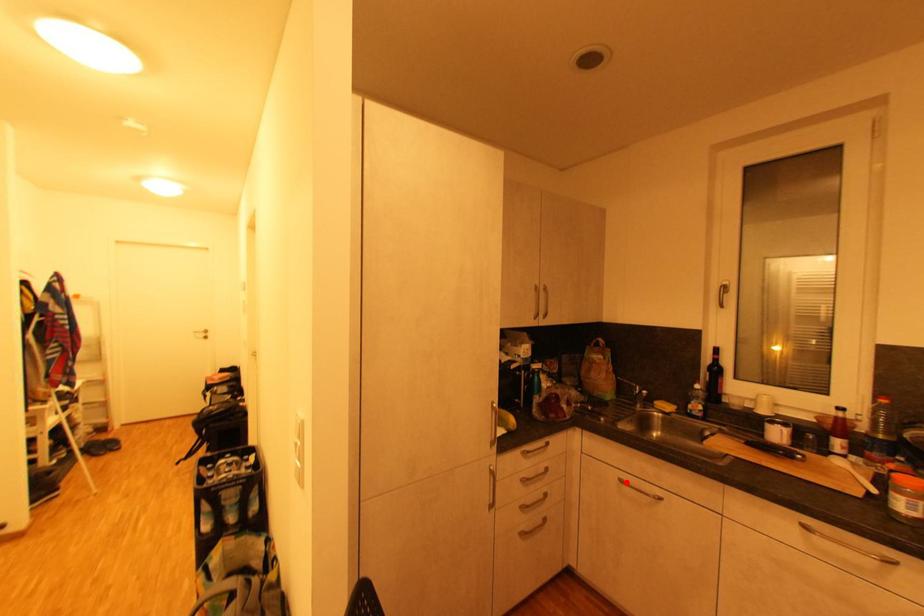
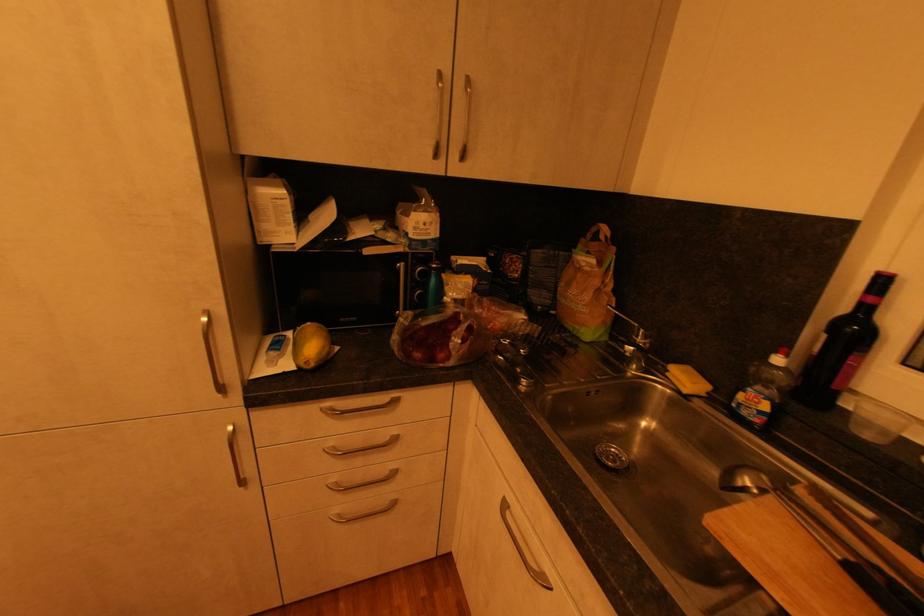
Question: I am providing you with two images of the same scene from different viewpoints. A red point is marked on the first image. Can you still see the location of the red point in image 2?

Choices:
 (A) Yes
 (B) No

Answer: (A)